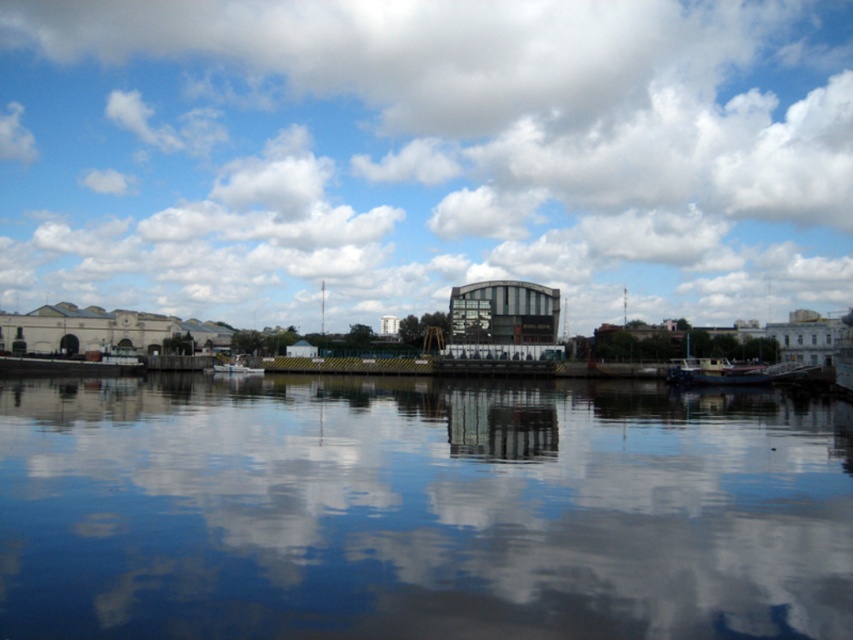
You are a photographer planning to take a photo of the transparent glass water at center and the glossy glass building at center. The camera you have can only focus on objects within a 40 feet range. Can both objects be in focus at the same time?

The transparent glass water at center and glossy glass building at center are 39.26 feet apart. Since the distance between them is less than 40 feet, the camera can focus on both objects simultaneously.

You are standing at the waterfront and looking out at the scene. There are two points marked in the image, point (117, 216) and point (227, 371). Which point is closer to you?

Point (117, 216) is closer to you because it is further to the viewer than point (227, 371).

You are standing at the waterfront and want to reach the point marked as point [573,106]. Given that the dock extends 1000 feet from the shore, can you safely walk to that point without going beyond the dock?

The point [573,106] is 1211.85 feet away from the viewer. Since the dock only extends 1000 feet, you cannot safely walk to that point as it is 211.85 feet beyond the dock.